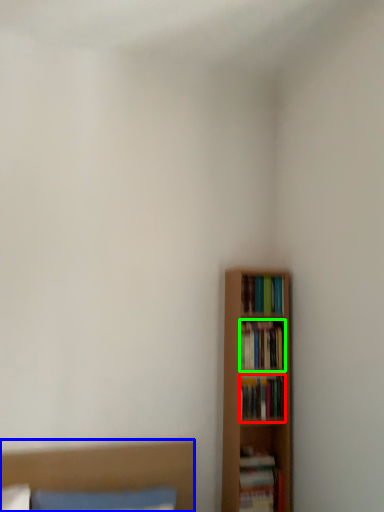
Question: Estimate the real-world distances between objects in this image. Which object is farther from book (highlighted by a red box), bed (highlighted by a blue box) or book (highlighted by a green box)?

Choices:
 (A) bed
 (B) book

Answer: (A)